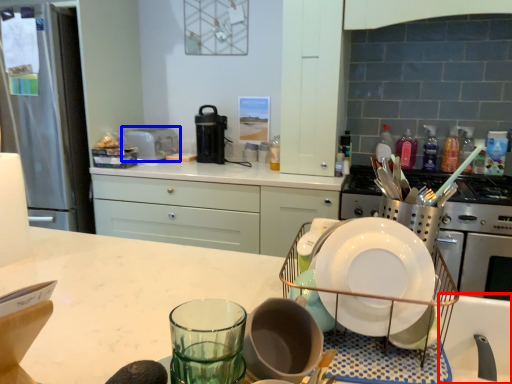
Question: Which object appears closest to the camera in this image, sink (highlighted by a red box) or appliance (highlighted by a blue box)?

Choices:
 (A) sink
 (B) appliance

Answer: (A)